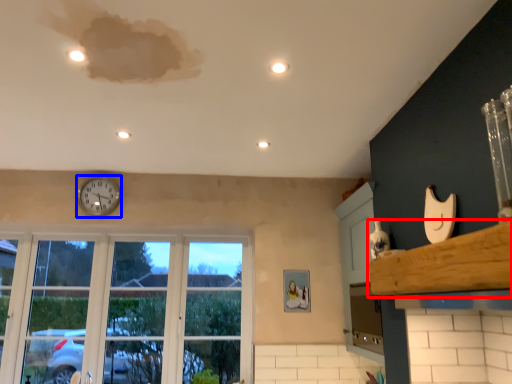
Question: Among these objects, which one is nearest to the camera, window sill (highlighted by a red box) or clock (highlighted by a blue box)?

Choices:
 (A) window sill
 (B) clock

Answer: (A)